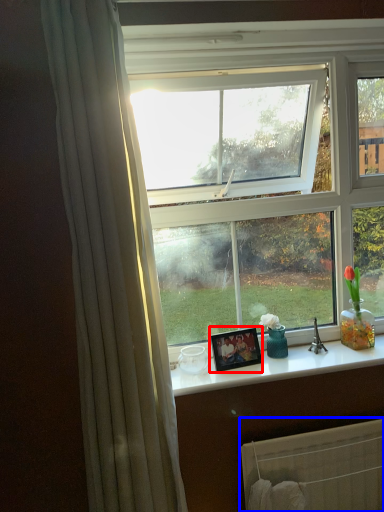
Question: Which object appears farthest to the camera in this image, picture frame (highlighted by a red box) or radiator (highlighted by a blue box)?

Choices:
 (A) picture frame
 (B) radiator

Answer: (A)